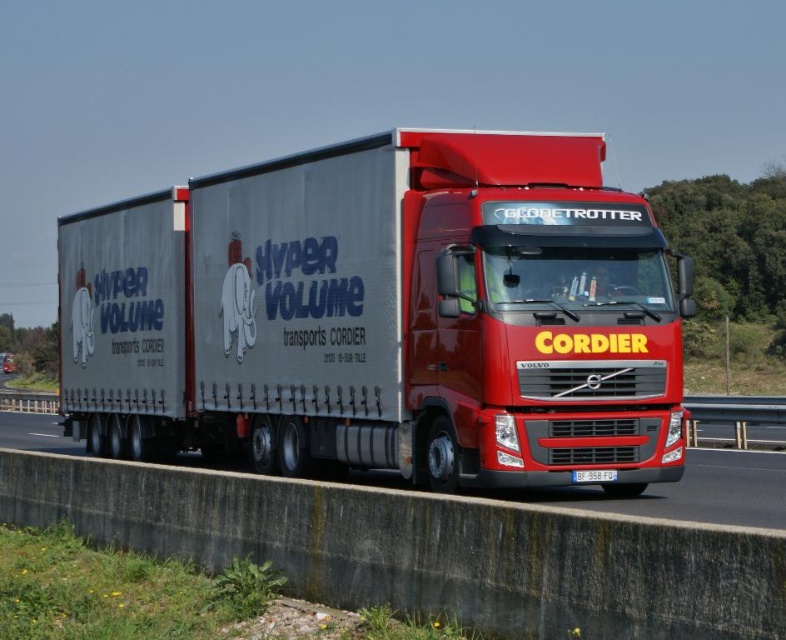
Can you confirm if metallic gray highway at center is positioned to the left of blue metallic license plate at center?

Correct, you'll find metallic gray highway at center to the left of blue metallic license plate at center.

From the picture: Who is positioned more to the right, metallic gray highway at center or blue metallic license plate at center?

blue metallic license plate at center is more to the right.

At what (x,y) coordinates should I click in order to perform the action: click on metallic gray highway at center. Please return your answer as a coordinate pair (x, y). Looking at the image, I should click on (703, 483).

Find the location of `metallic gray highway at center`. metallic gray highway at center is located at coordinates (703, 483).

From the picture: Can you confirm if metallic silver trailer at center is positioned to the right of blue metallic license plate at center?

No, metallic silver trailer at center is not to the right of blue metallic license plate at center.

Does point (533, 192) lie behind point (592, 481)?

Yes, point (533, 192) is farther from viewer.

Identify the location of metallic silver trailer at center. (384, 316).

Between metallic silver trailer at center and metallic gray highway at center, which one appears on the left side from the viewer's perspective?

metallic gray highway at center is more to the left.

Between point (616, 268) and point (39, 428), which one is positioned behind?

The point (39, 428) is more distant.

Is point (371, 156) farther from viewer compared to point (17, 428)?

No, it is in front of (17, 428).

Identify the location of metallic silver trailer at center. The image size is (786, 640). (384, 316).